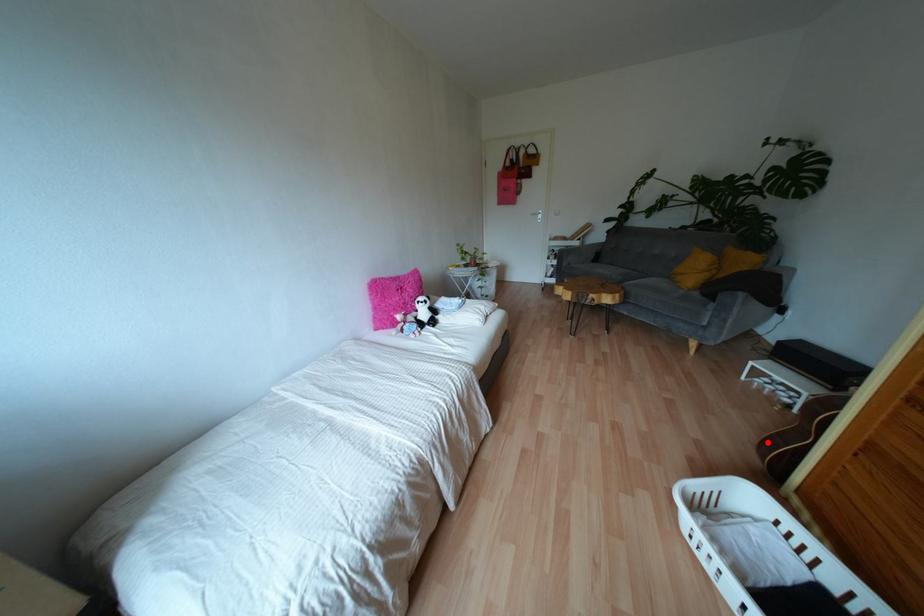
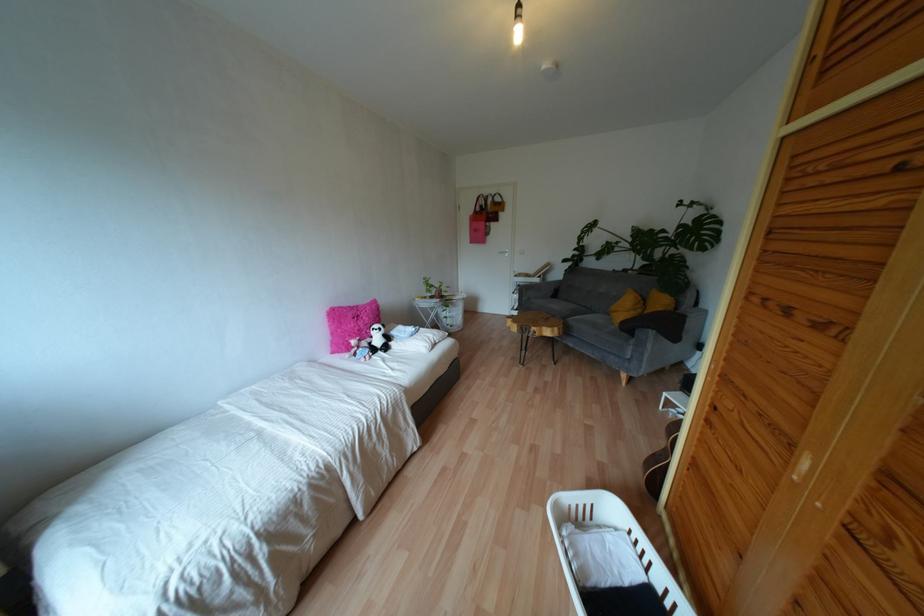
Where in the second image is the point corresponding to the highlighted location from the first image?

(648, 464)